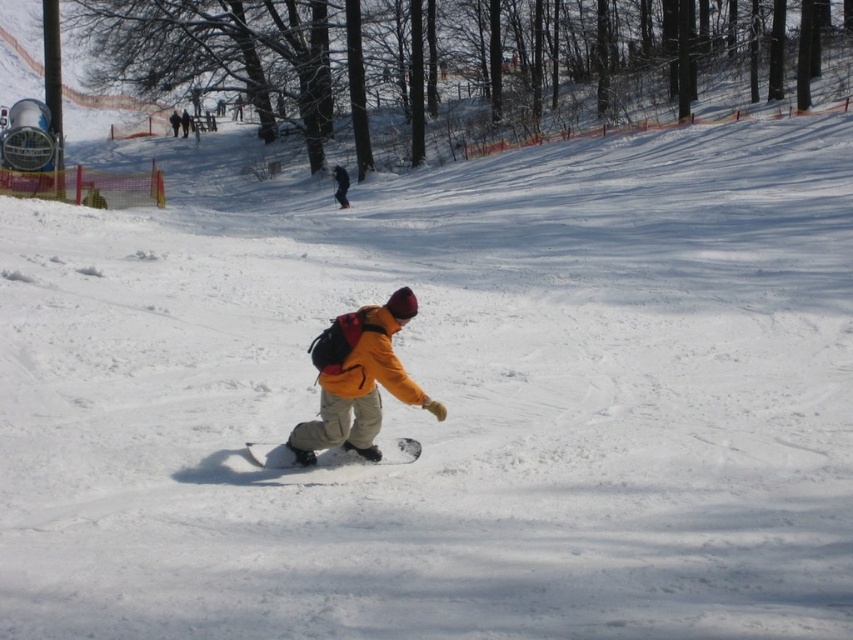
Looking at this image, you are a photographer trying to capture the snowboarder. You notice the white matte snowboard at center and the yellow matte jacket at center. Which object should you focus on first to ensure it appears sharp in the photo?

The white matte snowboard at center is closer to the viewer than the yellow matte jacket at center, so you should focus on the white matte snowboard at center first to ensure it appears sharp.

You are a photographer trying to capture a photo of the snowboarder. You want to ensure the white matte snowboard at center and the yellow matte jacket at center are both clearly visible. Which object should you focus on first to ensure both are in frame?

The white matte snowboard at center is positioned on the right side of the yellow matte jacket at center. To ensure both are in frame, focus on the yellow matte jacket at center first as it is closer to the center and the snowboard is adjacent to it.

You are a photographer trying to capture the snowboarder. You notice the matte yellow jacket at center and the white matte snowboard at center. Which object should you focus on first if you want to ensure both are in sharp focus?

The matte yellow jacket at center is in front of the white matte snowboard at center, so focusing on the matte yellow jacket at center first will help ensure both objects remain in focus as the background.